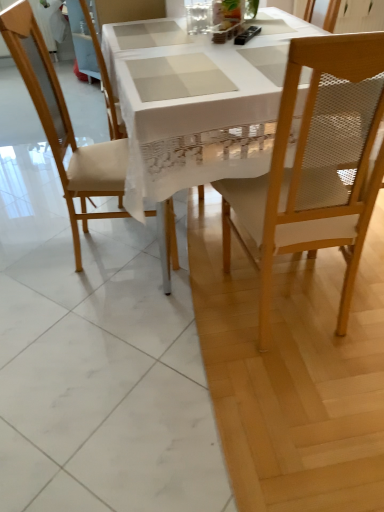
From the picture: In order to face light wood mesh chair at right, placed as the 3th chair when sorted from left to right, should I rotate leftwards or rightwards?

To face it directly, rotate right by 13.803 degrees.

The width and height of the screenshot is (384, 512). What do you see at coordinates (196, 104) in the screenshot?
I see `white lace tablecloth at center` at bounding box center [196, 104].

The image size is (384, 512). What do you see at coordinates (67, 122) in the screenshot? I see `matte wood chair at left, which is the first chair from left to right` at bounding box center [67, 122].

At what (x,y) coordinates should I click in order to perform the action: click on matte wood chair at left, which is the first chair from left to right. Please return your answer as a coordinate pair (x, y). This screenshot has height=512, width=384. Looking at the image, I should click on (67, 122).

Identify the location of light wood mesh chair at right, placed as the 3th chair when sorted from left to right. The image size is (384, 512). click(316, 166).

From the image's perspective, which is above, black plastic remote control at upper center or beige fabric chair at center, which is the second chair from left to right?

black plastic remote control at upper center, from the image's perspective.

In the scene shown: Is there a large distance between black plastic remote control at upper center and beige fabric chair at center, which is the second chair from left to right?

black plastic remote control at upper center is near beige fabric chair at center, which is the second chair from left to right, not far away.

You are a GUI agent. You are given a task and a screenshot of the screen. Output one action in this format:
    pyautogui.click(x=<x>, y=<y>)
    Task: Click on the remote control behind the beige fabric chair at center, which is the 2th chair in right-to-left order
    The image size is (384, 512).
    Given the screenshot: What is the action you would take?
    pyautogui.click(x=247, y=35)

How much distance is there between black plastic remote control at upper center and beige fabric chair at center, which is the 2th chair in right-to-left order?

The distance of black plastic remote control at upper center from beige fabric chair at center, which is the 2th chair in right-to-left order, is 27.88 inches.

Based on their sizes in the image, would you say beige fabric chair at center, which is the 2th chair in right-to-left order, is bigger or smaller than white lace tablecloth at center?

Clearly, beige fabric chair at center, which is the 2th chair in right-to-left order, is smaller in size than white lace tablecloth at center.

Looking at this image, which point is more distant from viewer, (130, 16) or (156, 64)?

Point (130, 16)

Who is shorter, beige fabric chair at center, which is the second chair from left to right, or white lace tablecloth at center?

Standing shorter between the two is white lace tablecloth at center.

Between white lace tablecloth at center and matte wood chair at left, which is the first chair from left to right, which one has larger width?

With larger width is white lace tablecloth at center.

Which is nearer, (138, 55) or (17, 3)?

The point (17, 3) is closer.

From a real-world perspective, which is physically above, white lace tablecloth at center or matte wood chair at left, placed as the 3th chair when sorted from right to left?

From a 3D spatial view, matte wood chair at left, placed as the 3th chair when sorted from right to left, is above.

Is the position of white lace tablecloth at center more distant than that of matte wood chair at left, which is the first chair from left to right?

No, white lace tablecloth at center is closer to the viewer.

From a real-world perspective, does matte wood chair at left, which is the first chair from left to right, sit lower than black plastic remote control at upper center?

Correct, in the physical world, matte wood chair at left, which is the first chair from left to right, is lower than black plastic remote control at upper center.

From the image's perspective, which object appears higher, matte wood chair at left, which is the first chair from left to right, or black plastic remote control at upper center?

black plastic remote control at upper center appears higher in the image.

Does matte wood chair at left, placed as the 3th chair when sorted from right to left, come in front of black plastic remote control at upper center?

That is True.

Can you confirm if matte wood chair at left, placed as the 3th chair when sorted from right to left, is positioned to the left of black plastic remote control at upper center?

Yes.

Can you confirm if matte wood chair at left, placed as the 3th chair when sorted from right to left, is positioned to the right of light wood mesh chair at right, placed as the 3th chair when sorted from left to right?

No, matte wood chair at left, placed as the 3th chair when sorted from right to left, is not to the right of light wood mesh chair at right, placed as the 3th chair when sorted from left to right.

Is matte wood chair at left, placed as the 3th chair when sorted from right to left, not within light wood mesh chair at right, placed as the 3th chair when sorted from left to right?

Absolutely, matte wood chair at left, placed as the 3th chair when sorted from right to left, is external to light wood mesh chair at right, placed as the 3th chair when sorted from left to right.

Identify the location of chair above the matte wood chair at left, placed as the 3th chair when sorted from right to left (from a real-world perspective). (316, 166).

From the image's perspective, is beige fabric chair at center, which is the 2th chair in right-to-left order, above or below light wood mesh chair at right, placed as the 3th chair when sorted from left to right?

Based on their image positions, beige fabric chair at center, which is the 2th chair in right-to-left order, is located above light wood mesh chair at right, placed as the 3th chair when sorted from left to right.

Is beige fabric chair at center, which is the second chair from left to right, to the left of light wood mesh chair at right, which is the first chair in right-to-left order, from the viewer's perspective?

Indeed, beige fabric chair at center, which is the second chair from left to right, is positioned on the left side of light wood mesh chair at right, which is the first chair in right-to-left order.

How different are the orientations of beige fabric chair at center, which is the second chair from left to right, and light wood mesh chair at right, placed as the 3th chair when sorted from left to right, in degrees?

They differ by 85.4 degrees in their facing directions.

From a real-world perspective, is white lace tablecloth at center located higher than black plastic remote control at upper center?

No, from a real-world perspective, white lace tablecloth at center is not on top of black plastic remote control at upper center.

Does white lace tablecloth at center turn towards black plastic remote control at upper center?

No.

Visually, is white lace tablecloth at center positioned to the left or to the right of black plastic remote control at upper center?

Based on their positions, white lace tablecloth at center is located to the left of black plastic remote control at upper center.

Between point (143, 126) and point (245, 39), which one is positioned behind?

Point (245, 39)

Identify the location of chair that is the 1st object to the left of the black plastic remote control at upper center, starting at the anchor. (129, 10).

The width and height of the screenshot is (384, 512). I want to click on desk that appears on the right of beige fabric chair at center, which is the 2th chair in right-to-left order, so click(x=196, y=104).

Considering their positions, is white lace tablecloth at center positioned closer to matte wood chair at left, placed as the 3th chair when sorted from right to left, than beige fabric chair at center, which is the second chair from left to right?

The object closer to matte wood chair at left, placed as the 3th chair when sorted from right to left, is white lace tablecloth at center.

From the image, which object appears to be nearer to beige fabric chair at center, which is the second chair from left to right, light wood mesh chair at right, placed as the 3th chair when sorted from left to right, or white lace tablecloth at center?

white lace tablecloth at center is positioned closer to the anchor beige fabric chair at center, which is the second chair from left to right.

Estimate the real-world distances between objects in this image. Which object is further from beige fabric chair at center, which is the second chair from left to right, white lace tablecloth at center or matte wood chair at left, which is the first chair from left to right?

matte wood chair at left, which is the first chair from left to right, is positioned further to the anchor beige fabric chair at center, which is the second chair from left to right.

Based on their spatial positions, is black plastic remote control at upper center or beige fabric chair at center, which is the second chair from left to right, closer to white lace tablecloth at center?

black plastic remote control at upper center lies closer to white lace tablecloth at center than the other object.

Considering their positions, is matte wood chair at left, which is the first chair from left to right, positioned further to black plastic remote control at upper center than white lace tablecloth at center?

matte wood chair at left, which is the first chair from left to right, is further to black plastic remote control at upper center.

Looking at the image, which one is located closer to light wood mesh chair at right, which is the first chair in right-to-left order, white lace tablecloth at center or matte wood chair at left, placed as the 3th chair when sorted from right to left?

white lace tablecloth at center.

Based on their spatial positions, is light wood mesh chair at right, placed as the 3th chair when sorted from left to right, or matte wood chair at left, which is the first chair from left to right, further from white lace tablecloth at center?

Among the two, matte wood chair at left, which is the first chair from left to right, is located further to white lace tablecloth at center.

Considering their positions, is beige fabric chair at center, which is the second chair from left to right, positioned closer to light wood mesh chair at right, which is the first chair in right-to-left order, than black plastic remote control at upper center?

black plastic remote control at upper center is closer to light wood mesh chair at right, which is the first chair in right-to-left order.

What are the coordinates of `desk between matte wood chair at left, which is the first chair from left to right, and black plastic remote control at upper center, in the horizontal direction` in the screenshot? It's located at (196, 104).

Identify the location of chair between light wood mesh chair at right, which is the first chair in right-to-left order, and beige fabric chair at center, which is the 2th chair in right-to-left order, along the z-axis. This screenshot has width=384, height=512. (67, 122).

Identify the location of desk located between matte wood chair at left, which is the first chair from left to right, and light wood mesh chair at right, which is the first chair in right-to-left order, in the left-right direction. (196, 104).

Locate an element on the screen. The image size is (384, 512). chair between matte wood chair at left, which is the first chair from left to right, and black plastic remote control at upper center from left to right is located at coordinates (129, 10).